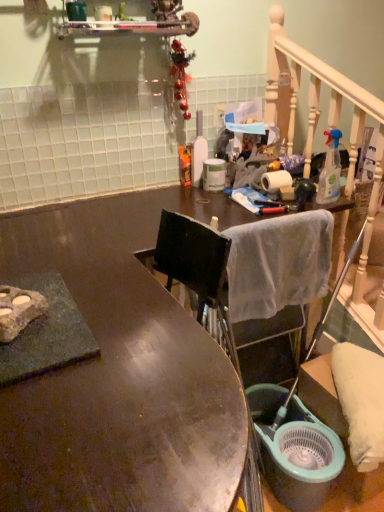
Identify the location of free spot above shiny brown desk at center (from a real-world perspective). The height and width of the screenshot is (512, 384). click(x=109, y=374).